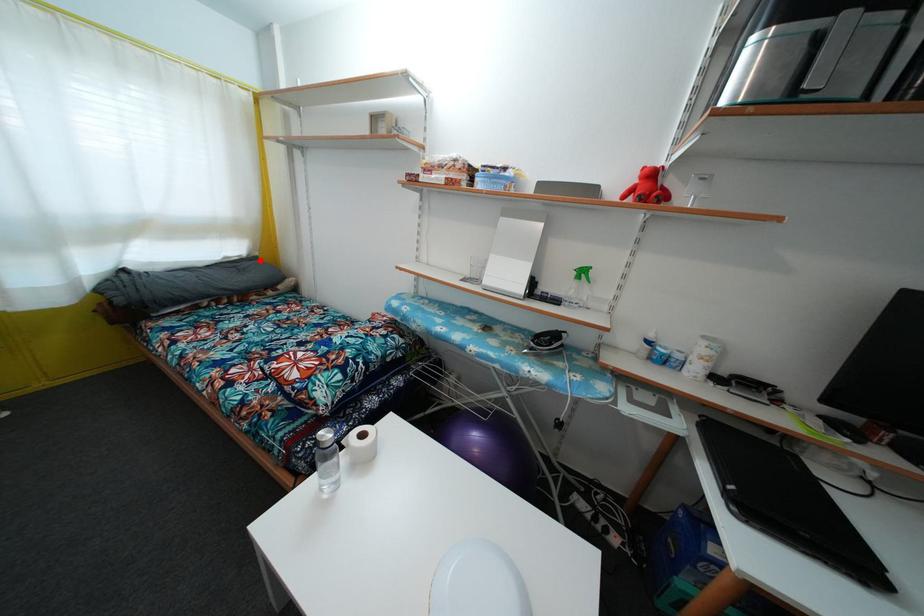
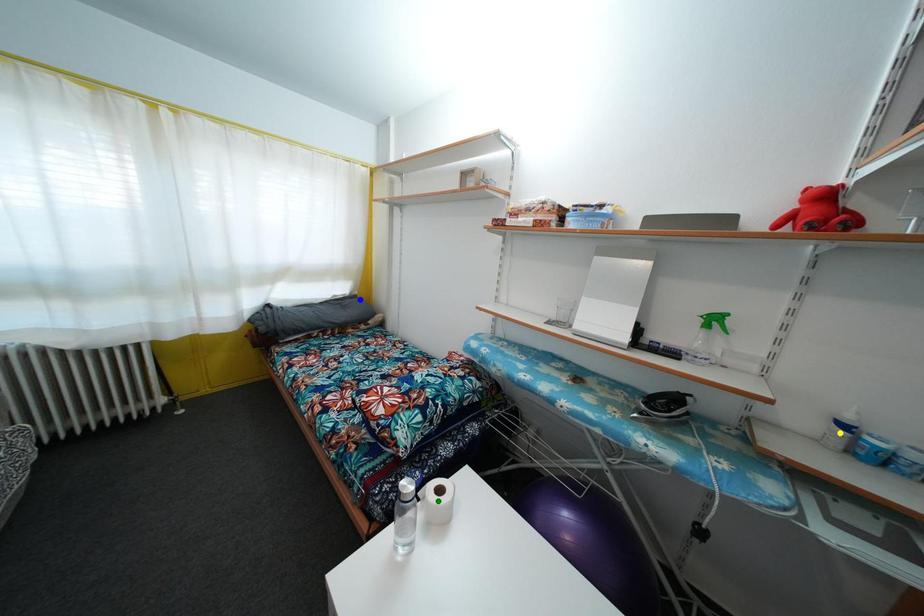
Question: I am providing you with two images of the same scene from different viewpoints. A red point is marked on the first image. You are given multiple points on the second image. In image 2, which mark is for the same physical point as the one in image 1?

Choices:
 (A) blue point
 (B) yellow point
 (C) green point

Answer: (A)